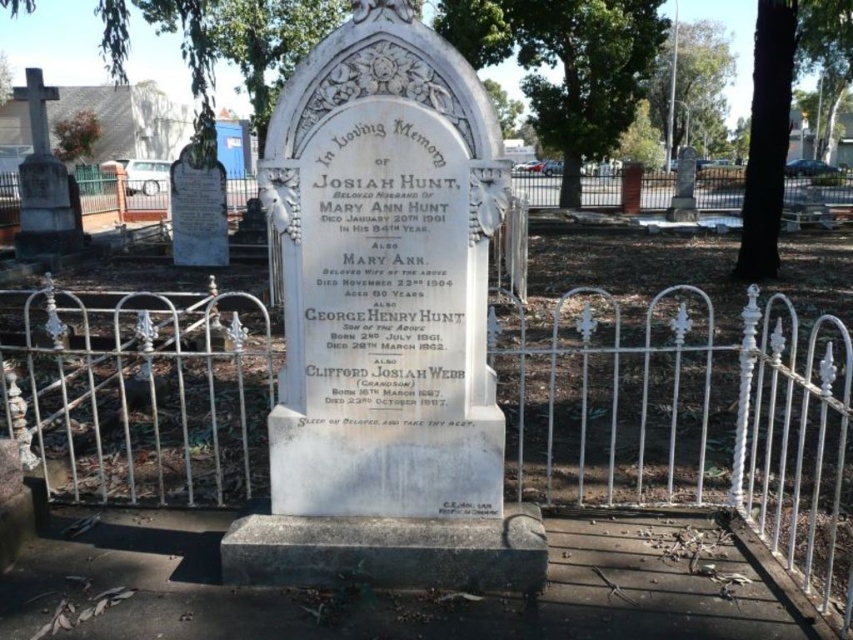
Is green leafy tree at upper center below white wrought iron fence at upper center?

Incorrect, green leafy tree at upper center is not positioned below white wrought iron fence at upper center.

Measure the distance between green leafy tree at upper center and camera.

The distance of green leafy tree at upper center from camera is 75.02 feet.

You are a GUI agent. You are given a task and a screenshot of the screen. Output one action in this format:
    pyautogui.click(x=<x>, y=<y>)
    Task: Click on the green leafy tree at upper center
    The width and height of the screenshot is (853, 640).
    Given the screenshot: What is the action you would take?
    pyautogui.click(x=566, y=65)

Which is in front, point (614, 376) or point (671, 29)?

Point (614, 376) is in front.

Who is more distant from viewer, [183,372] or [717,83]?

Point [717,83]

What do you see at coordinates (688, 419) in the screenshot?
I see `white wrought iron fence at center` at bounding box center [688, 419].

The image size is (853, 640). I want to click on white wrought iron fence at center, so click(x=688, y=419).

Is white wrought iron fence at upper center positioned behind green leafy tree at upper right?

No, white wrought iron fence at upper center is closer to the viewer.

Describe the element at coordinates (120, 193) in the screenshot. I see `white wrought iron fence at upper center` at that location.

This screenshot has width=853, height=640. I want to click on white wrought iron fence at upper center, so click(120, 193).